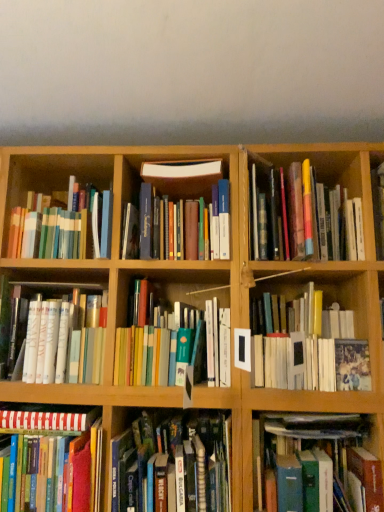
Question: Does hardcover book at center, which is the 6th book from left to right, have a greater width compared to hardcover books at center, which appears as the fourth book when viewed from the left?

Choices:
 (A) no
 (B) yes

Answer: (B)

Question: From a real-world perspective, is hardcover book at center, the fourth book viewed from the right, physically below hardcover books at center, which appears as the fourth book when viewed from the left?

Choices:
 (A) yes
 (B) no

Answer: (B)

Question: Does hardcover book at center, the fourth book viewed from the right, turn towards hardcover books at center, which appears as the fourth book when viewed from the left?

Choices:
 (A) no
 (B) yes

Answer: (A)

Question: Is the position of hardcover book at center, the fourth book viewed from the right, more distant than that of hardcover books at center, which is counted as the 6th book, starting from the right?

Choices:
 (A) yes
 (B) no

Answer: (A)

Question: Is hardcover book at center, which is the 6th book from left to right, not near hardcover books at center, which appears as the fourth book when viewed from the left?

Choices:
 (A) yes
 (B) no

Answer: (B)

Question: Is hardcover book at center, the fourth book viewed from the right, turned away from hardcover books at center, which appears as the fourth book when viewed from the left?

Choices:
 (A) no
 (B) yes

Answer: (A)

Question: Is white matte book at left, the second book viewed from the left, completely or partially outside of hardcover books at center, the 5th book when ordered from left to right?

Choices:
 (A) yes
 (B) no

Answer: (A)

Question: Does white matte book at left, placed as the 8th book when sorted from right to left, appear on the left side of hardcover books at center, positioned as the fifth book in right-to-left order?

Choices:
 (A) no
 (B) yes

Answer: (B)

Question: Is hardcover books at center, positioned as the fifth book in right-to-left order, completely or partially inside white matte book at left, placed as the 8th book when sorted from right to left?

Choices:
 (A) no
 (B) yes

Answer: (A)

Question: From a real-world perspective, is white matte book at left, the second book viewed from the left, located beneath hardcover books at center, positioned as the fifth book in right-to-left order?

Choices:
 (A) yes
 (B) no

Answer: (A)

Question: Does white matte book at left, placed as the 8th book when sorted from right to left, have a lesser height compared to hardcover books at center, the 5th book when ordered from left to right?

Choices:
 (A) no
 (B) yes

Answer: (B)

Question: From the image's perspective, is white matte book at left, the second book viewed from the left, beneath hardcover books at center, positioned as the fifth book in right-to-left order?

Choices:
 (A) yes
 (B) no

Answer: (A)

Question: From the image's perspective, would you say hardcover books at center, the 5th book when ordered from left to right, is positioned over hardcover book at center right, which is the eighth book from left to right?

Choices:
 (A) yes
 (B) no

Answer: (B)